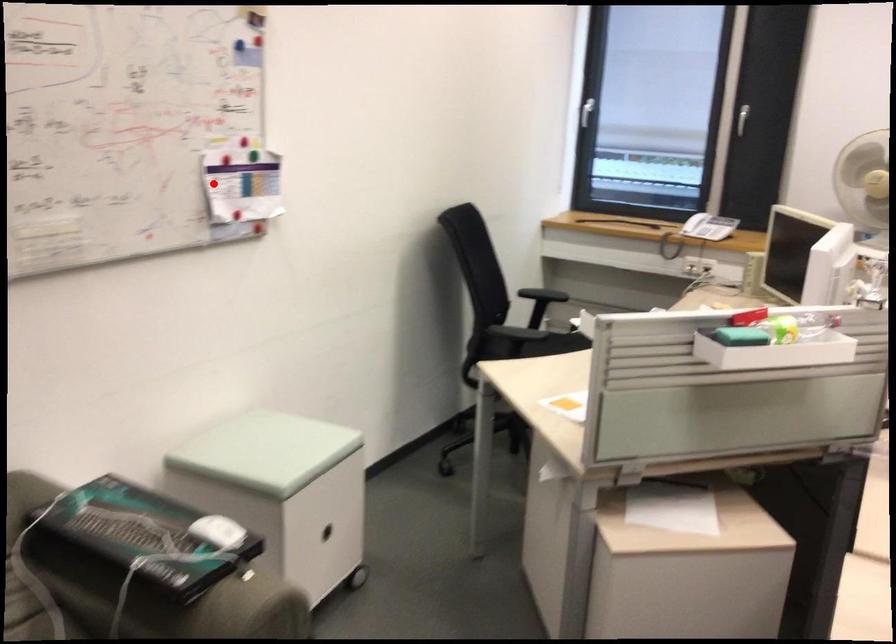
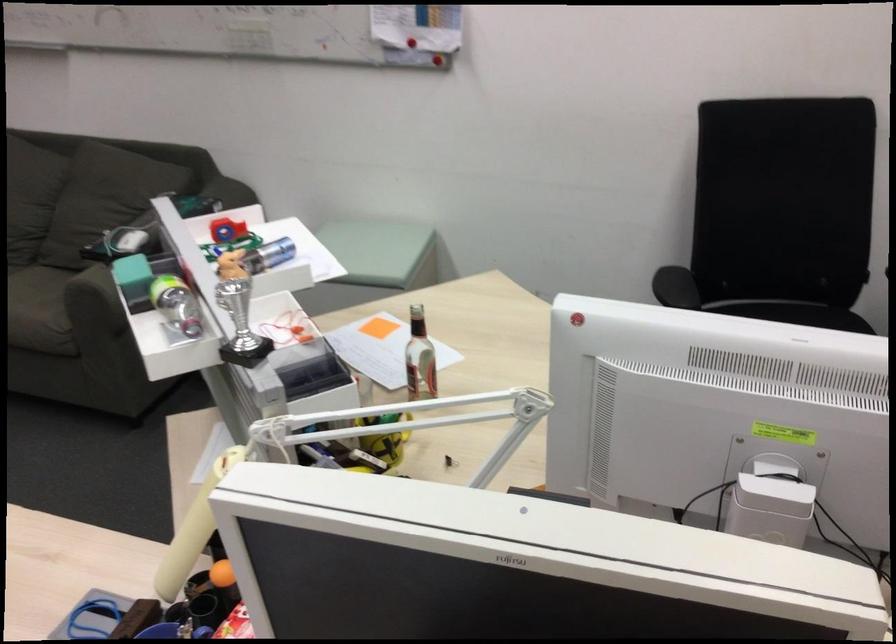
Where in the second image is the point corresponding to the highlighted location from the first image?

(401, 13)